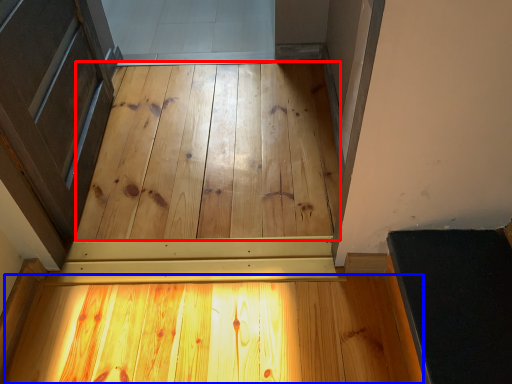
Question: Which object is further to the camera taking this photo, plywood (highlighted by a red box) or plywood (highlighted by a blue box)?

Choices:
 (A) plywood
 (B) plywood

Answer: (A)